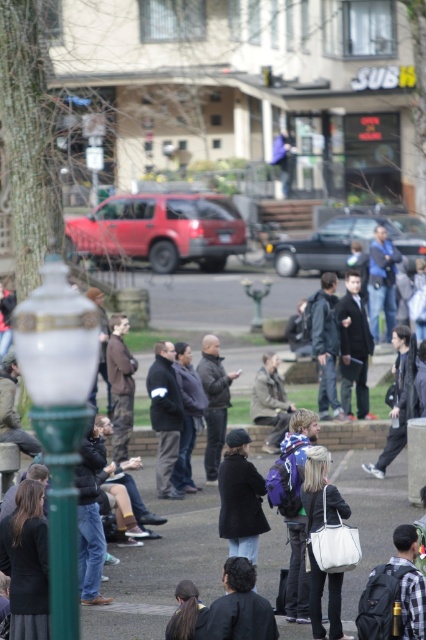
You are a photographer trying to capture a closeup of the matte black jacket at center without including the concrete pavement at center in the frame. Given their sizes, is this feasible?

The matte black jacket at center has a larger size compared to concrete pavement at center. Since the jacket is larger, it can be framed to exclude the smaller concrete pavement at center by adjusting the camera angle or zoom.

You are a photographer standing in the public square, and you want to take a photo of the matte black jacket at center and the concrete pavement at center. Which object is positioned higher in the frame?

The matte black jacket at center is above the concrete pavement at center, so it is positioned higher in the frame.